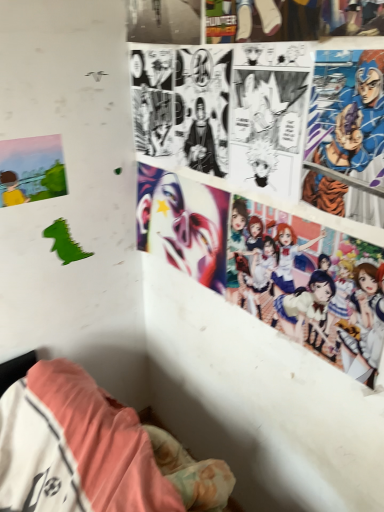
Question: Can you confirm if colorful anime characters at upper right, which is the first person in bottom-to-top order, is thinner than matte paper poster at left?

Choices:
 (A) no
 (B) yes

Answer: (A)

Question: Is colorful anime characters at upper right, which is counted as the 2th person, starting from the top, further to camera compared to matte paper poster at left?

Choices:
 (A) yes
 (B) no

Answer: (B)

Question: Is colorful anime characters at upper right, which is the first person in bottom-to-top order, placed right next to matte paper poster at left?

Choices:
 (A) yes
 (B) no

Answer: (B)

Question: From the image's perspective, does colorful anime characters at upper right, which is the first person in bottom-to-top order, appear higher than matte paper poster at left?

Choices:
 (A) no
 (B) yes

Answer: (A)

Question: Could matte paper poster at left be considered to be inside colorful anime characters at upper right, which is counted as the 2th person, starting from the top?

Choices:
 (A) no
 (B) yes

Answer: (A)

Question: In terms of height, does colorful anime characters at upper right, which is counted as the 2th person, starting from the top, look taller or shorter compared to matte paper poster at left?

Choices:
 (A) tall
 (B) short

Answer: (A)

Question: Is colorful anime characters at upper right, which is counted as the 2th person, starting from the top, in front of or behind matte paper poster at left in the image?

Choices:
 (A) front
 (B) behind

Answer: (A)

Question: Would you say colorful anime characters at upper right, which is counted as the 2th person, starting from the top, is inside or outside matte paper poster at left?

Choices:
 (A) outside
 (B) inside

Answer: (A)

Question: Considering the positions of point (364, 269) and point (21, 158), is point (364, 269) closer or farther from the camera than point (21, 158)?

Choices:
 (A) closer
 (B) farther

Answer: (A)

Question: Is matte paper poster at left in front of or behind shiny metallic mask at center in the image?

Choices:
 (A) behind
 (B) front

Answer: (B)

Question: From the image's perspective, relative to shiny metallic mask at center, is matte paper poster at left above or below?

Choices:
 (A) above
 (B) below

Answer: (A)

Question: From a real-world perspective, is matte paper poster at left physically located above or below shiny metallic mask at center?

Choices:
 (A) above
 (B) below

Answer: (A)

Question: Based on their positions, is matte paper poster at left located to the left or right of shiny metallic mask at center?

Choices:
 (A) right
 (B) left

Answer: (B)

Question: Is point (339, 124) closer or farther from the camera than point (324, 303)?

Choices:
 (A) closer
 (B) farther

Answer: (A)

Question: Based on their sizes in the image, would you say blue metallic armor at upper right, acting as the 1th person starting from the top, is bigger or smaller than colorful anime characters at upper right, which is counted as the 2th person, starting from the top?

Choices:
 (A) small
 (B) big

Answer: (A)